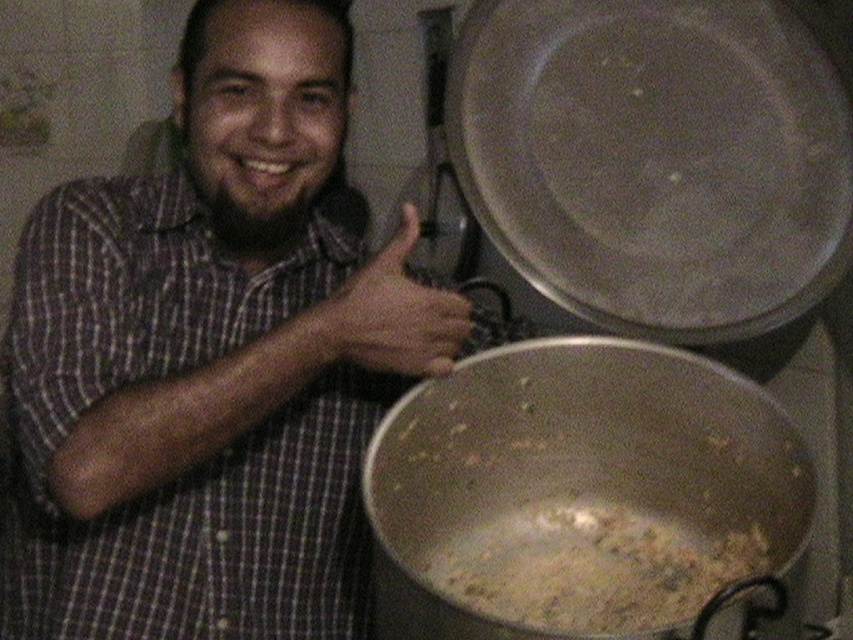
Question: Does matte plaid shirt at center come in front of brown crumbly food at center?

Choices:
 (A) no
 (B) yes

Answer: (A)

Question: Can you confirm if brown crumbly food at center is positioned below brown leather hand at center?

Choices:
 (A) yes
 (B) no

Answer: (A)

Question: Which point is farther to the camera?

Choices:
 (A) brown leather hand at center
 (B) brown crumbly food at center
 (C) metallic silver pot at lower center

Answer: (A)

Question: Is metallic silver pot at lower center wider than brown leather hand at center?

Choices:
 (A) yes
 (B) no

Answer: (A)

Question: Which point is farther to the camera?

Choices:
 (A) (560, 540)
 (B) (463, 632)
 (C) (229, 406)

Answer: (A)

Question: Which point is closer to the camera?

Choices:
 (A) (165, 632)
 (B) (379, 352)

Answer: (B)